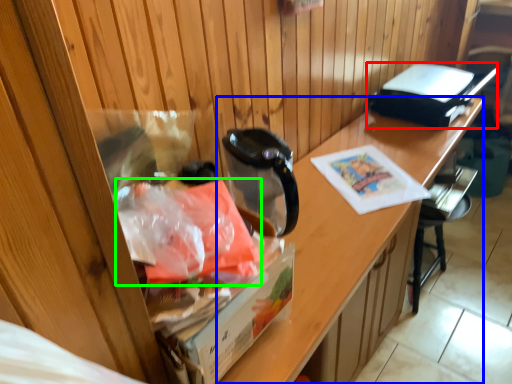
Question: Considering the real-world distances, which object is farthest from appliance (highlighted by a red box)? desk (highlighted by a blue box) or material (highlighted by a green box)?

Choices:
 (A) desk
 (B) material

Answer: (B)